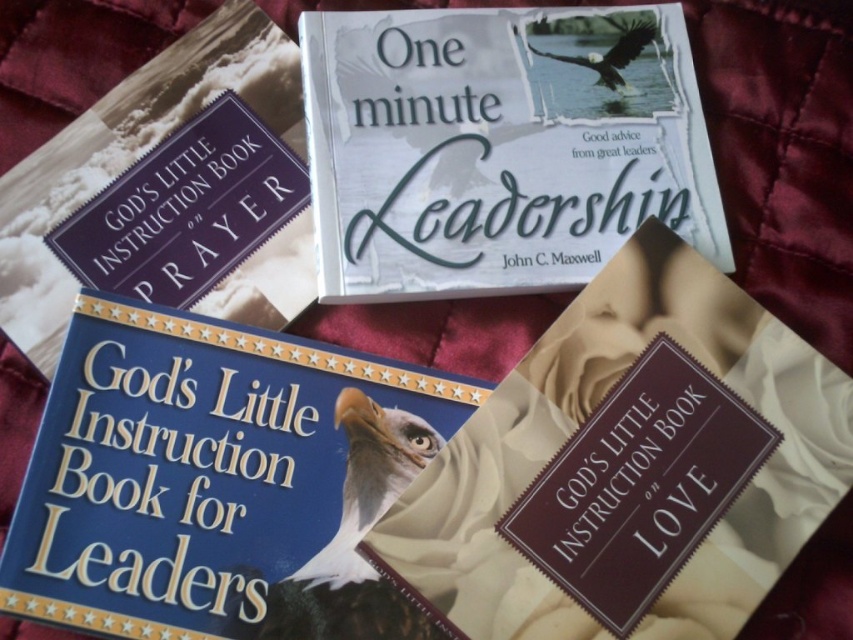
You are organizing a bookshelf and have two books in front of you. The blue hardcover book at center and the white paper book at center. Which book is shorter in height?

The blue hardcover book at center is not as tall as the white paper book at center, so the blue hardcover book at center is shorter.

You are standing 4 feet away from the camera. A point at coordinates [772,388] is part of an object in the image. Is this point closer to you or farther than your current position?

The distance of point [772,388] from the camera is 3.61 feet. Since you are standing 4 feet away from the camera, this point is farther than your current position.

You are organizing a bookshelf and need to place the blue hardcover book at center and the matte brown book on love at lower right. Given their widths, which book should you place first to ensure they fit side by side without overlapping?

The blue hardcover book at center has a lesser width compared to the matte brown book on love at lower right. Therefore, you should place the matte brown book on love at lower right first to accommodate its wider size, then position the narrower blue hardcover book at center next to it.